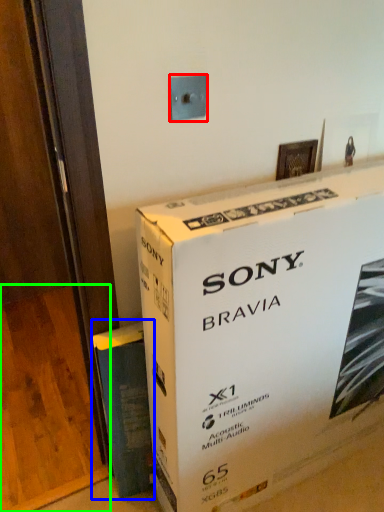
Question: Estimate the real-world distances between objects in this image. Which object is farther from electric outlet (highlighted by a red box), paperback book (highlighted by a blue box) or plywood (highlighted by a green box)?

Choices:
 (A) paperback book
 (B) plywood

Answer: (B)